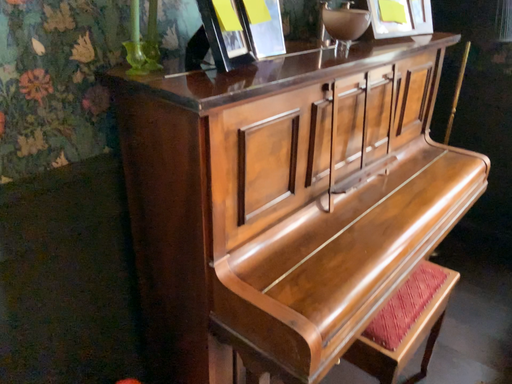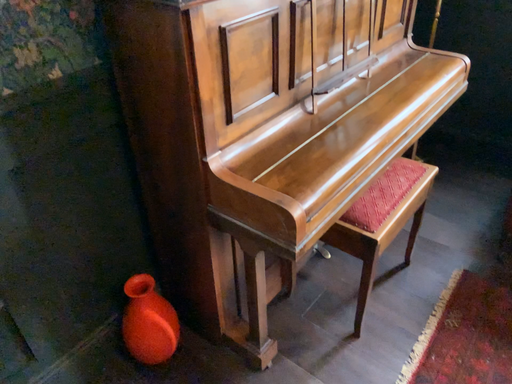
Question: How did the camera likely rotate when shooting the video?

Choices:
 (A) rotated upward
 (B) rotated downward

Answer: (B)